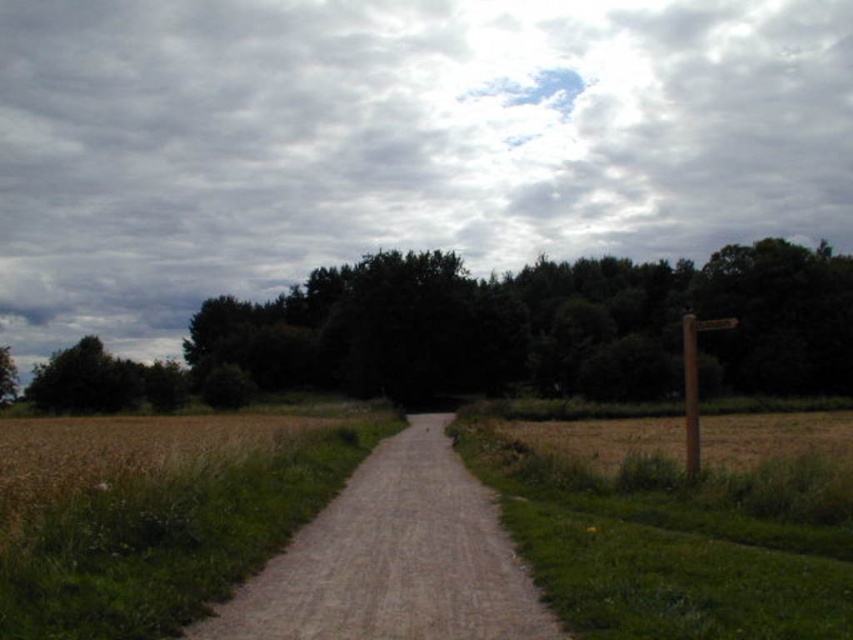
Question: Is the position of green leafy tree at upper center less distant than that of dirt/gravel path at center?

Choices:
 (A) yes
 (B) no

Answer: (B)

Question: Among these points, which one is farthest from the camera?

Choices:
 (A) (776, 340)
 (B) (534, 634)
 (C) (181, 225)

Answer: (C)

Question: Does cloudy sky at upper center have a greater width compared to dirt/gravel path at center?

Choices:
 (A) no
 (B) yes

Answer: (B)

Question: Which is farther from the green leafy tree at upper center?

Choices:
 (A) cloudy sky at upper center
 (B) dirt/gravel path at center

Answer: (A)

Question: Which is nearer to the cloudy sky at upper center?

Choices:
 (A) dirt/gravel path at center
 (B) green leafy tree at upper center

Answer: (B)

Question: Is cloudy sky at upper center below dirt/gravel path at center?

Choices:
 (A) no
 (B) yes

Answer: (A)